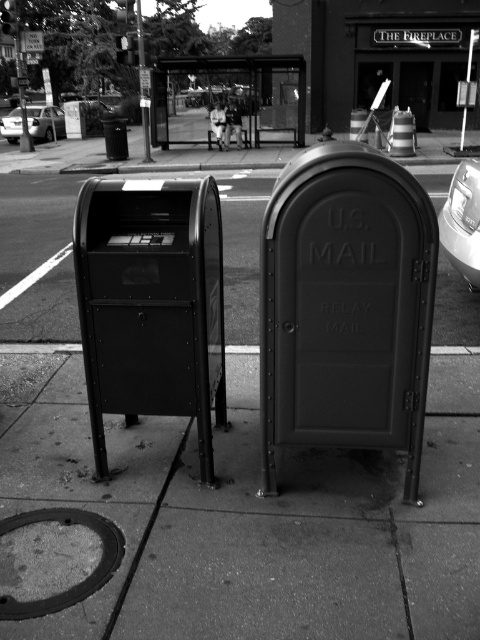
Does matte black mailbox at center have a greater height compared to metallic silver car at right?

Indeed, matte black mailbox at center has a greater height compared to metallic silver car at right.

Does matte black mailbox at center come behind metallic silver car at right?

No, it is not.

This screenshot has width=480, height=640. What do you see at coordinates (346, 307) in the screenshot?
I see `matte black mailbox at center` at bounding box center [346, 307].

At what (x,y) coordinates should I click in order to perform the action: click on matte black mailbox at center. Please return your answer as a coordinate pair (x, y). The image size is (480, 640). Looking at the image, I should click on (346, 307).

Is metallic silver sedan at left shorter than white fabric couple at center?

In fact, metallic silver sedan at left may be taller than white fabric couple at center.

Is point (36, 138) behind point (218, 129)?

Yes, point (36, 138) is farther from viewer.

Who is more forward, (48, 136) or (225, 140)?

Point (225, 140) is more forward.

The height and width of the screenshot is (640, 480). What are the coordinates of `metallic silver sedan at left` in the screenshot? It's located at (45, 122).

The height and width of the screenshot is (640, 480). Describe the element at coordinates (346, 307) in the screenshot. I see `matte black mailbox at center` at that location.

Is matte black mailbox at center positioned in front of metallic silver sedan at left?

Yes.

Does point (387, 180) come farther from viewer compared to point (37, 134)?

No, (387, 180) is closer to viewer.

The image size is (480, 640). What are the coordinates of `matte black mailbox at center` in the screenshot? It's located at (346, 307).